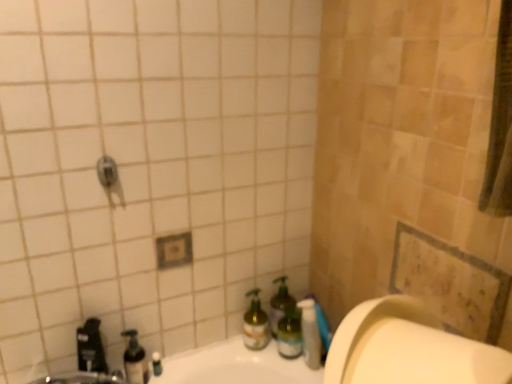
Question: Is green glass spray bottle at lower center, the second bottle positioned from the left, bigger or smaller than green glass bottle at lower right, placed as the fourth bottle when sorted from left to right?

Choices:
 (A) big
 (B) small

Answer: (B)

Question: In terms of height, does green glass spray bottle at lower center, which is counted as the 3th bottle, starting from the right, look taller or shorter compared to green glass bottle at lower right, placed as the fourth bottle when sorted from left to right?

Choices:
 (A) tall
 (B) short

Answer: (B)

Question: Which object is positioned closest to the green glass bottle at lower center, which is the 3th bottle in left-to-right order?

Choices:
 (A) translucent plastic soap dispenser at lower left
 (B) green glass bottle at lower right, the first bottle from the right
 (C) brushed metal faucet at lower left
 (D) green glass spray bottle at lower center, the second bottle positioned from the left
 (E) translucent plastic soap dispenser at lower left, positioned as the 4th bottle in right-to-left order

Answer: (B)

Question: Considering the real-world distances, which object is closest to the green glass bottle at lower right, placed as the fourth bottle when sorted from left to right?

Choices:
 (A) brushed metal faucet at lower left
 (B) translucent plastic pump bottle at lower center
 (C) green glass spray bottle at lower center, which is counted as the 3th bottle, starting from the right
 (D) translucent plastic soap dispenser at lower left, the first bottle in the left-to-right sequence
 (E) green glass bottle at lower center, which is the 3th bottle in left-to-right order

Answer: (E)